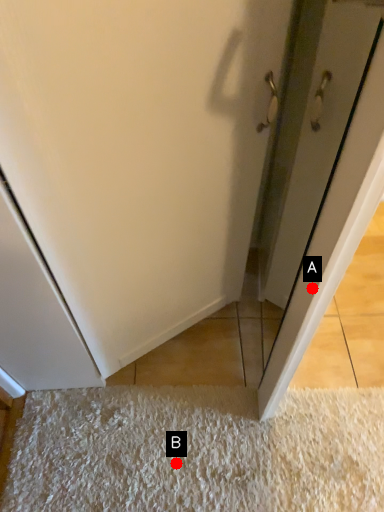
Question: Two points are circled on the image, labeled by A and B beside each circle. Which point is closer to the camera?

Choices:
 (A) A is closer
 (B) B is closer

Answer: (A)